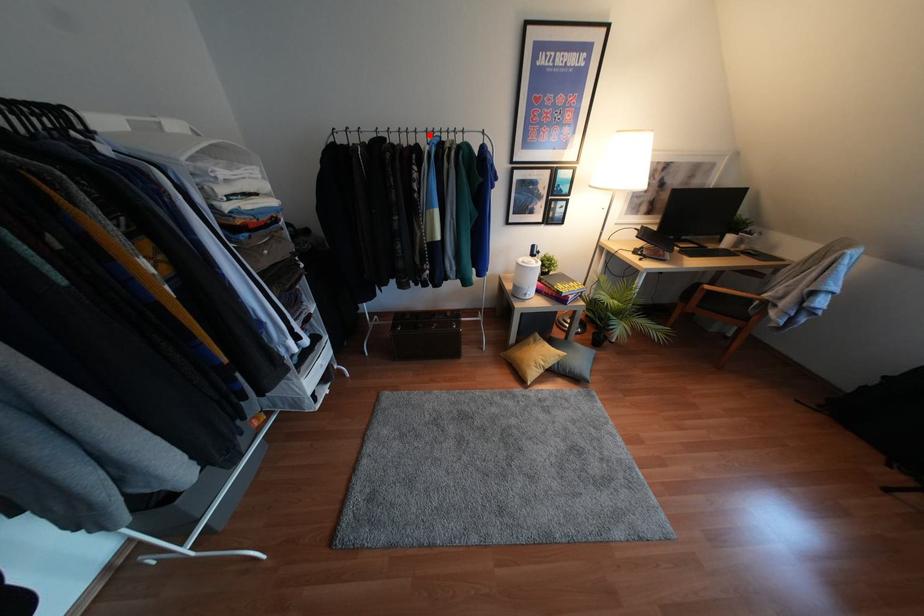
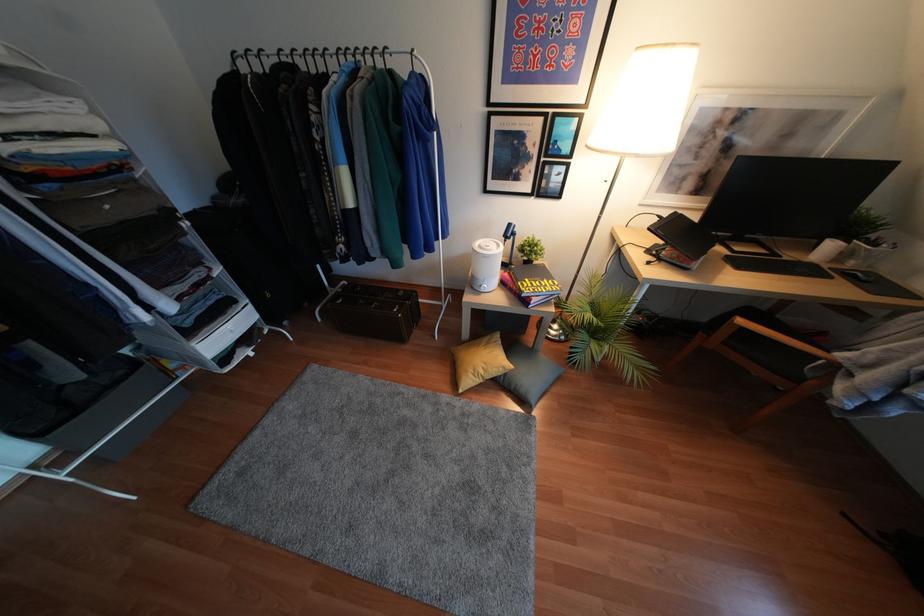
In the second image, find the point that corresponds to the highlighted location in the first image.

(342, 59)